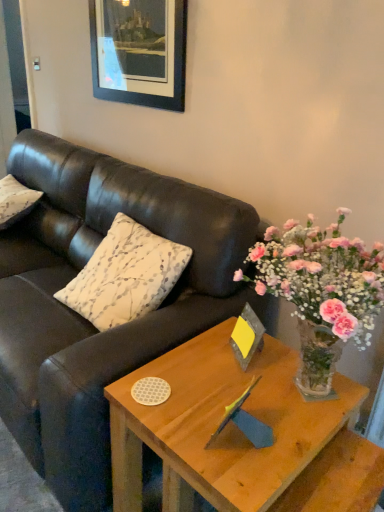
The height and width of the screenshot is (512, 384). Identify the location of vacant area situated to the left side of wooden block with yellow card at center, placed as the 2th picture frame when sorted from top to bottom. click(x=200, y=357).